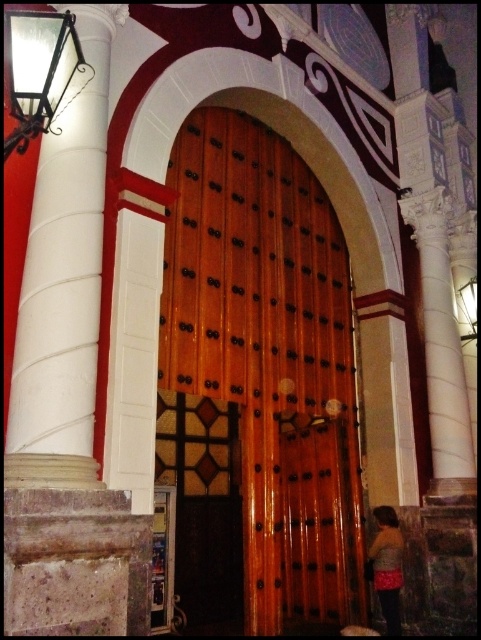
Which is above, wooden door at center or brown textured sweater at lower right?

Positioned higher is brown textured sweater at lower right.

Who is more forward, (342, 358) or (390, 524)?

Point (390, 524) is more forward.

At what (x,y) coordinates should I click in order to perform the action: click on wooden door at center. Please return your answer as a coordinate pair (x, y). Image resolution: width=481 pixels, height=640 pixels. Looking at the image, I should click on (269, 360).

The height and width of the screenshot is (640, 481). I want to click on wooden door at center, so click(269, 360).

Describe the element at coordinates (63, 285) in the screenshot. I see `white marble column at left` at that location.

The image size is (481, 640). I want to click on white marble column at left, so click(x=63, y=285).

This screenshot has width=481, height=640. Find the location of `white marble column at left`. white marble column at left is located at coordinates (63, 285).

Which is above, wooden door at center or white marble column at left?

white marble column at left is higher up.

Can you confirm if wooden door at center is positioned to the right of white marble column at left?

Indeed, wooden door at center is positioned on the right side of white marble column at left.

Locate an element on the screen. Image resolution: width=481 pixels, height=640 pixels. wooden door at center is located at coordinates (269, 360).

Find the location of a particular element. The image size is (481, 640). wooden door at center is located at coordinates (269, 360).